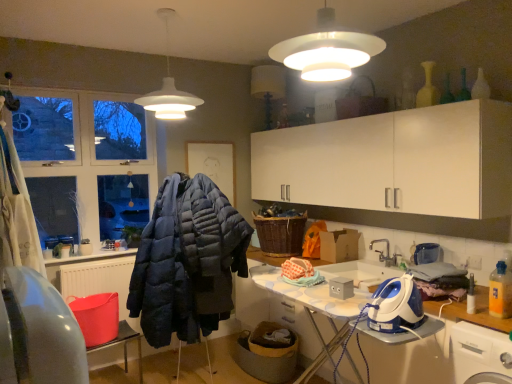
Question: Is point (396, 326) positioned closer to the camera than point (270, 253)?

Choices:
 (A) farther
 (B) closer

Answer: (B)

Question: In the image, is blue plastic iron at lower right positioned in front of or behind woven brown basket at center?

Choices:
 (A) behind
 (B) front

Answer: (B)

Question: Based on their relative distances, which object is nearer to the dark blue quilted jacket at center?

Choices:
 (A) white plastic washing machine at lower right
 (B) blue plastic iron at lower right
 (C) woven brown basket at center
 (D) white matte lampshade at upper center, the 2th lamp from the front
 (E) white matte lampshade at upper center, which is counted as the 1th lamp, starting from the right

Answer: (C)

Question: Considering the real-world distances, which object is closest to the white plastic washing machine at lower right?

Choices:
 (A) white matte lampshade at upper center, the 2th lamp from the front
 (B) woven brown basket at center
 (C) white matte lampshade at upper center, the second lamp viewed from the left
 (D) blue plastic iron at lower right
 (E) dark blue quilted jacket at center

Answer: (D)